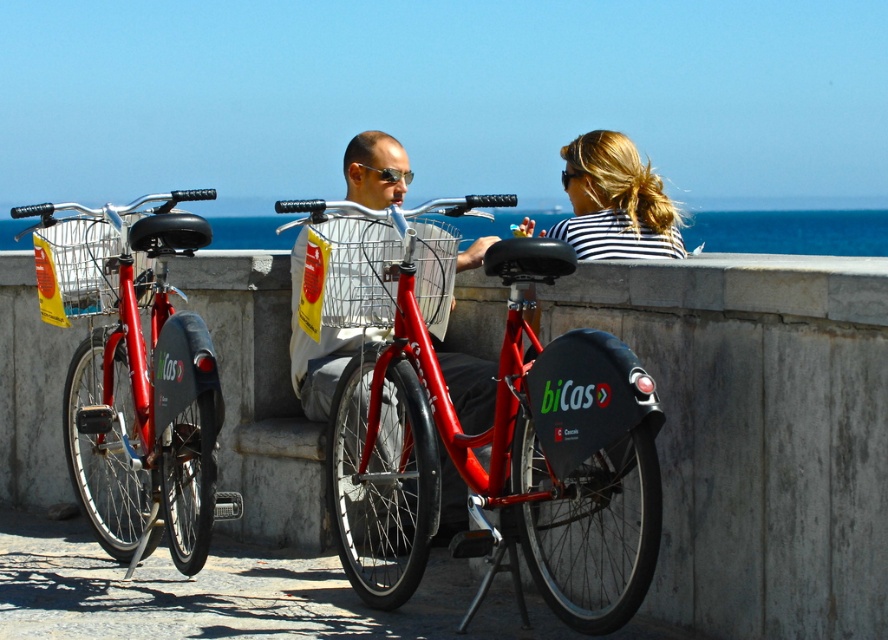
Is shiny red bicycle at center to the left of striped fabric hair at center from the viewer's perspective?

Indeed, shiny red bicycle at center is positioned on the left side of striped fabric hair at center.

Which is behind, point (465, 468) or point (631, 160)?

Point (631, 160)

Find the location of a particular element. shiny red bicycle at center is located at coordinates (486, 428).

Does point (367, 518) come farther from viewer compared to point (197, 339)?

Yes, it is.

This screenshot has width=888, height=640. I want to click on shiny red bicycle at center, so click(x=486, y=428).

Who is higher up, shiny red bicycle at center or shiny metallic bicycle at center?

shiny metallic bicycle at center

Does shiny red bicycle at center appear on the left side of shiny metallic bicycle at center?

No, shiny red bicycle at center is not to the left of shiny metallic bicycle at center.

Who is more forward, [498,358] or [470,404]?

Point [470,404] is more forward.

At what (x,y) coordinates should I click in order to perform the action: click on shiny red bicycle at center. Please return your answer as a coordinate pair (x, y). This screenshot has width=888, height=640. Looking at the image, I should click on (486, 428).